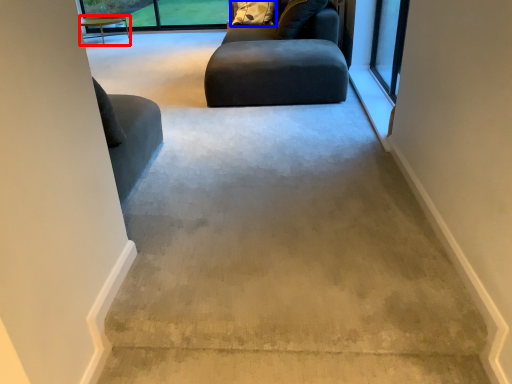
Question: Which point is further to the camera, table (highlighted by a red box) or pillow (highlighted by a blue box)?

Choices:
 (A) table
 (B) pillow

Answer: (A)